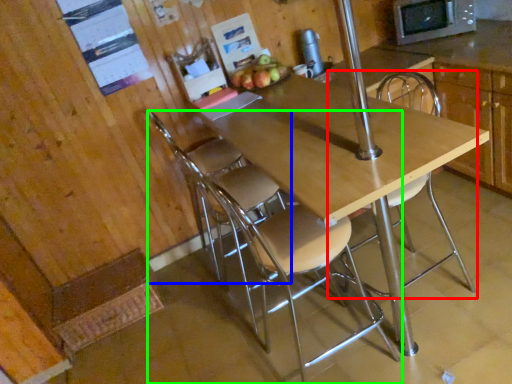
Question: Which is nearer to the chair (highlighted by a red box)? chair (highlighted by a blue box) or chair (highlighted by a green box).

Choices:
 (A) chair
 (B) chair

Answer: (B)